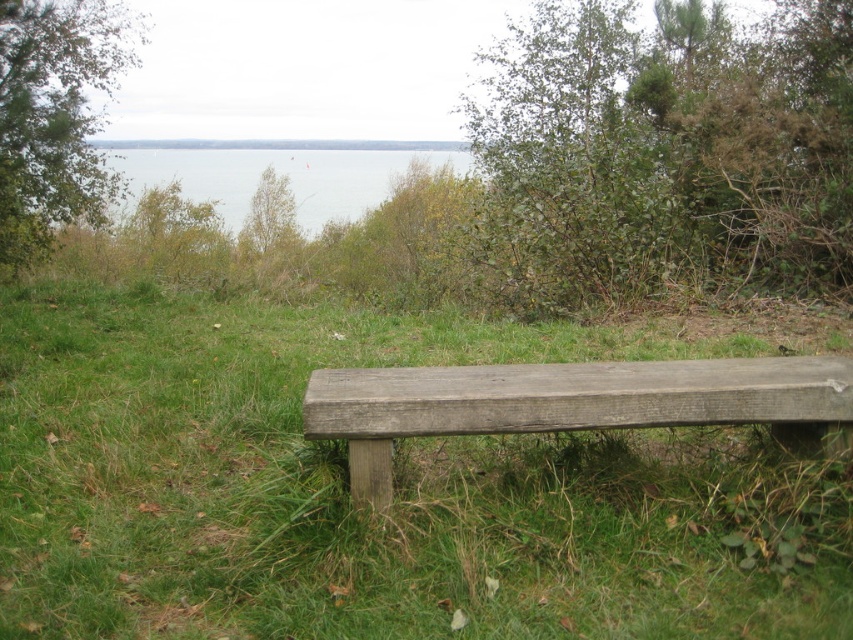
You are standing at the point marked by the coordinate (393, 484). What object is located at this coordinate in the scene?

The green rough wood bench at center is located at the coordinate point (393, 484).

You are standing at the bottom left corner of the image. You want to walk to the green rough wood bench at center. In which general direction should you head?

Since the green rough wood bench at center is located at coordinates approximately 0.759 on the x axis and 0.463 on the y axis, you should head towards the right and slightly upwards from the bottom left corner to reach it.